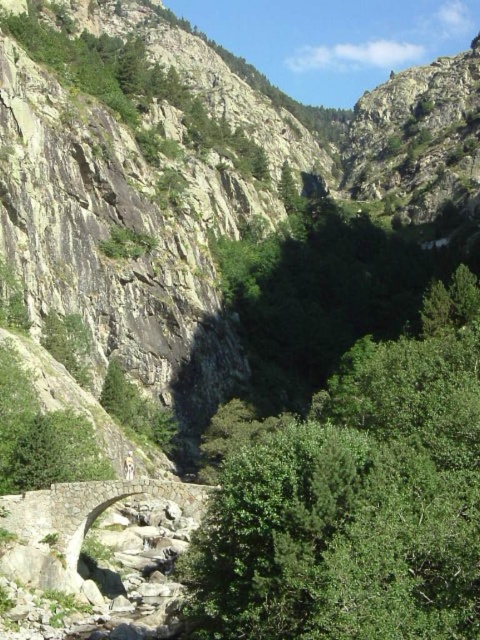
You are a hiker planning to cross the stone bridge at center. You notice a green leafy tree at center nearby. Which object is bigger in size?

The green leafy tree at center is larger in size than the stone bridge at center.

You are a hiker standing on the stone bridge at center. You notice a green leafy tree at center in your view. From your current position, which object is closer to you?

The green leafy tree at center is closer to you because it is positioned in front of the stone bridge at center from your viewpoint.

You are a hiker standing on the stone bridge at center and want to take a photo of the green leafy tree at center. In which direction should you point your camera to capture the tree?

The green leafy tree at center is positioned on the right side of the stone bridge at center, so you should point your camera to the right to capture the tree.